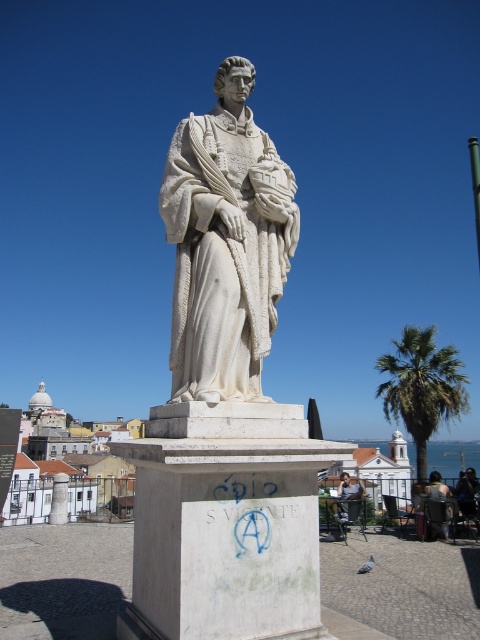
Can you confirm if white marble statue at center is shorter than light brown wooden chair at lower right?

Answer: Indeed, white marble statue at center has a lesser height compared to light brown wooden chair at lower right.

Between white marble statue at center and light brown wooden chair at lower right, which one has more height?

light brown wooden chair at lower right

Is point (220, 248) farther from camera compared to point (344, 497)?

No, it is not.

Locate an element on the screen. This screenshot has width=480, height=640. white marble statue at center is located at coordinates (226, 243).

The width and height of the screenshot is (480, 640). Describe the element at coordinates (226, 243) in the screenshot. I see `white marble statue at center` at that location.

Can you confirm if white marble statue at center is smaller than green leafy palm tree at right?

Yes, white marble statue at center is smaller than green leafy palm tree at right.

Is point (206, 340) closer to viewer compared to point (421, 364)?

Yes, point (206, 340) is closer to viewer.

Image resolution: width=480 pixels, height=640 pixels. I want to click on white marble statue at center, so pyautogui.click(x=226, y=243).

Which is more to the left, green leafy palm tree at right or light brown wooden chair at lower right?

light brown wooden chair at lower right

What are the coordinates of `green leafy palm tree at right` in the screenshot? It's located at (421, 387).

I want to click on green leafy palm tree at right, so click(421, 387).

This screenshot has width=480, height=640. I want to click on green leafy palm tree at right, so click(421, 387).